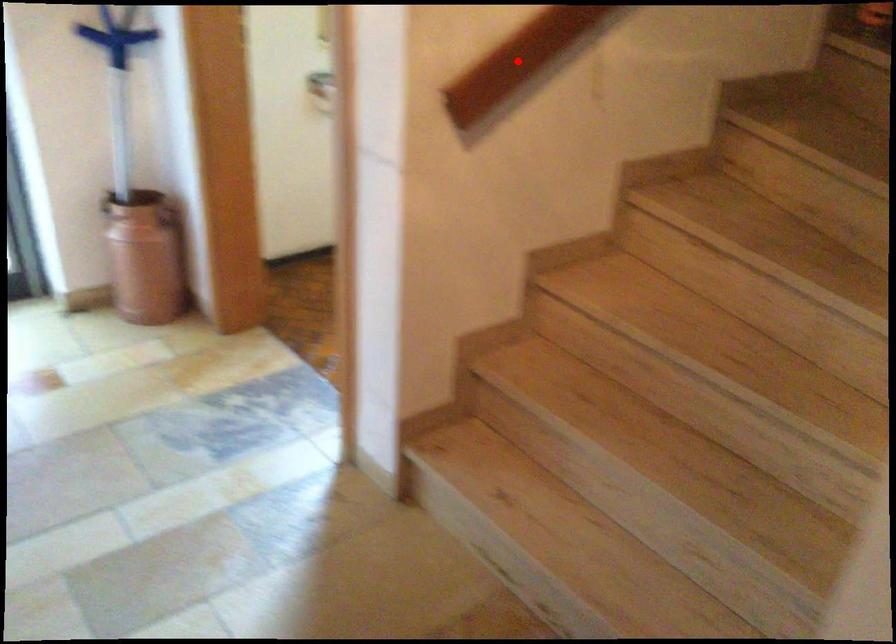
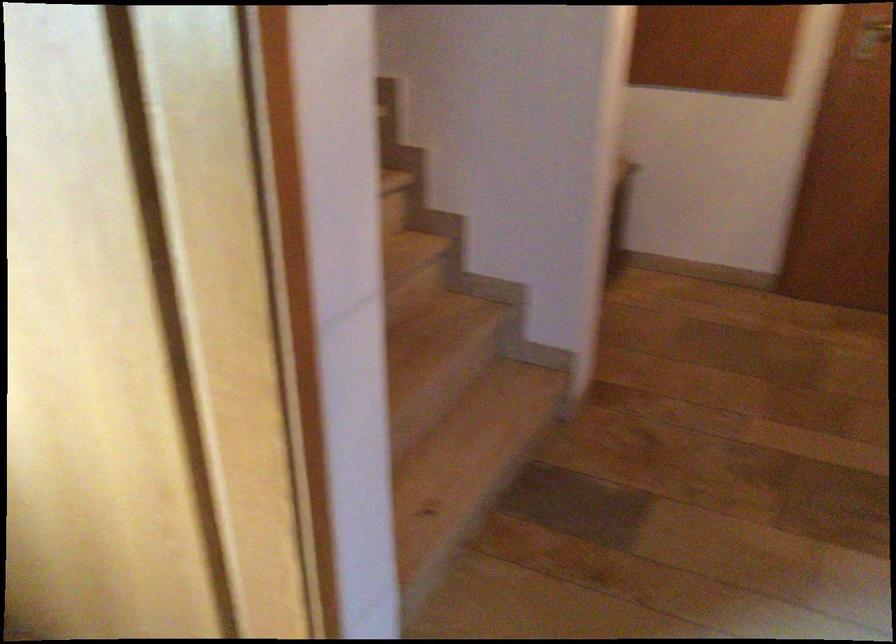
Question: I am providing you with two images of the same scene from different viewpoints. A red point is marked on the first image. Is the red point's position out of view in image 2?

Choices:
 (A) Yes
 (B) No

Answer: (A)